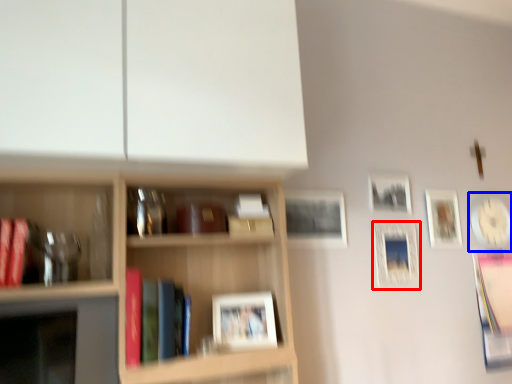
Question: Which point is closer to the camera, picture frame (highlighted by a red box) or picture frame (highlighted by a blue box)?

Choices:
 (A) picture frame
 (B) picture frame

Answer: (A)